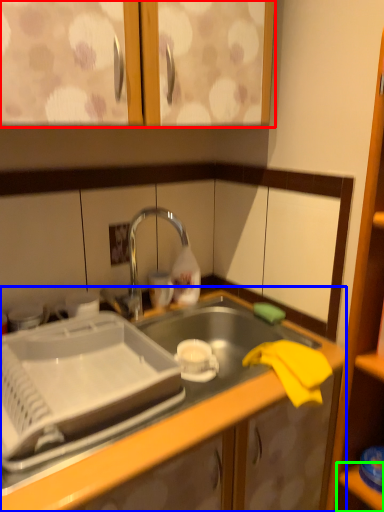
Question: Which object is the closest to the cabinetry (highlighted by a red box)? Choose among these: countertop (highlighted by a blue box) or shelf (highlighted by a green box).

Choices:
 (A) countertop
 (B) shelf

Answer: (A)